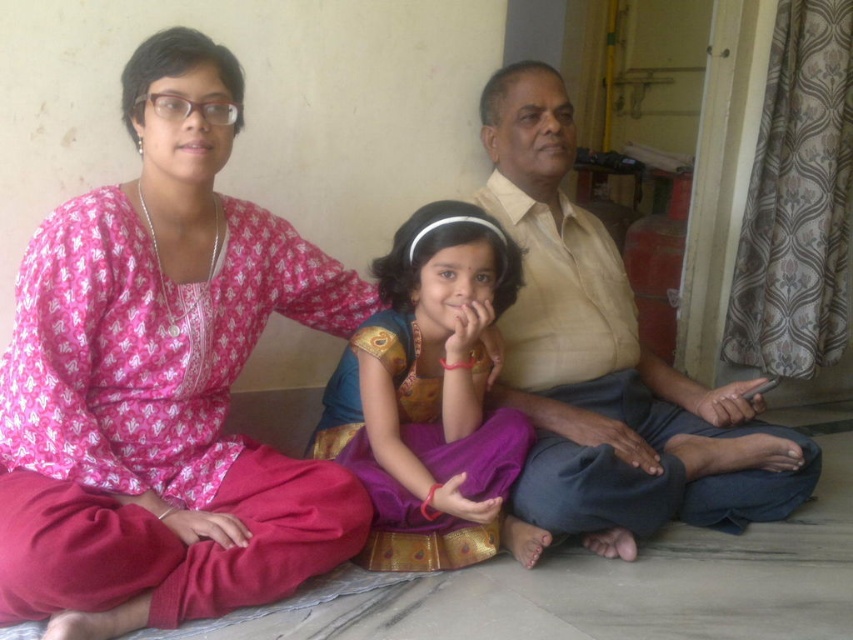
Who is shorter, beige cotton shirt at center or purple satin saree at center?

purple satin saree at center

What do you see at coordinates (608, 362) in the screenshot? Image resolution: width=853 pixels, height=640 pixels. I see `beige cotton shirt at center` at bounding box center [608, 362].

Does point (585, 385) lie behind point (413, 433)?

Yes, point (585, 385) is farther from viewer.

Locate an element on the screen. beige cotton shirt at center is located at coordinates (608, 362).

Can you confirm if pink printed dress at left is thinner than beige cotton shirt at center?

Yes.

I want to click on pink printed dress at left, so point(161,381).

The width and height of the screenshot is (853, 640). Describe the element at coordinates (161, 381) in the screenshot. I see `pink printed dress at left` at that location.

This screenshot has height=640, width=853. What are the coordinates of `pink printed dress at left` in the screenshot? It's located at (161, 381).

The image size is (853, 640). What do you see at coordinates (161, 381) in the screenshot?
I see `pink printed dress at left` at bounding box center [161, 381].

Where is `pink printed dress at left`? The image size is (853, 640). pink printed dress at left is located at coordinates (161, 381).